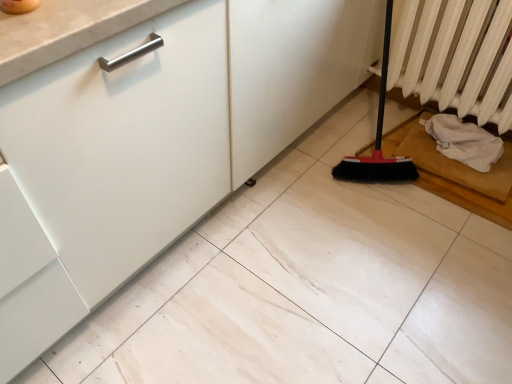
Question: Is white textured radiator at right situated inside white fabric at lower right or outside?

Choices:
 (A) inside
 (B) outside

Answer: (B)

Question: Looking at their shapes, would you say white textured radiator at right is wider or thinner than white fabric at lower right?

Choices:
 (A) wide
 (B) thin

Answer: (B)

Question: In the image, is white textured radiator at right positioned in front of or behind white fabric at lower right?

Choices:
 (A) front
 (B) behind

Answer: (A)

Question: From a real-world perspective, is white fabric at lower right positioned above or below white textured radiator at right?

Choices:
 (A) below
 (B) above

Answer: (A)

Question: Considering the positions of white fabric at lower right and white textured radiator at right in the image, is white fabric at lower right bigger or smaller than white textured radiator at right?

Choices:
 (A) big
 (B) small

Answer: (B)

Question: Looking at their shapes, would you say white fabric at lower right is wider or thinner than white textured radiator at right?

Choices:
 (A) thin
 (B) wide

Answer: (B)

Question: Is point (448, 135) closer or farther from the camera than point (404, 3)?

Choices:
 (A) farther
 (B) closer

Answer: (A)